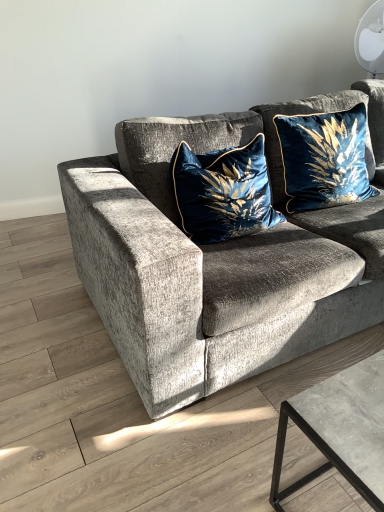
Question: Is velvet gray couch at center positioned far away from velvet blue pillow at center, acting as the 1th pillow starting from the left?

Choices:
 (A) no
 (B) yes

Answer: (A)

Question: Is velvet gray couch at center thinner than velvet blue pillow at center, acting as the 1th pillow starting from the left?

Choices:
 (A) no
 (B) yes

Answer: (A)

Question: Is velvet gray couch at center at the left side of velvet blue pillow at center, acting as the 1th pillow starting from the left?

Choices:
 (A) no
 (B) yes

Answer: (A)

Question: Considering the relative positions of velvet gray couch at center and velvet blue pillow at center, acting as the 1th pillow starting from the left, in the image provided, is velvet gray couch at center to the right of velvet blue pillow at center, acting as the 1th pillow starting from the left, from the viewer's perspective?

Choices:
 (A) yes
 (B) no

Answer: (A)

Question: From a real-world perspective, is velvet gray couch at center positioned under velvet blue pillow at center, acting as the 2th pillow starting from the right, based on gravity?

Choices:
 (A) no
 (B) yes

Answer: (B)

Question: Is velvet gray couch at center outside velvet blue pillow at center, acting as the 1th pillow starting from the left?

Choices:
 (A) yes
 (B) no

Answer: (A)

Question: Is velvet blue pillow at upper right, which ranks as the 2th pillow in left-to-right order, taller than velvet blue pillow at center, acting as the 1th pillow starting from the left?

Choices:
 (A) yes
 (B) no

Answer: (A)

Question: Would you say velvet blue pillow at upper right, the first pillow from the right, contains velvet blue pillow at center, acting as the 2th pillow starting from the right?

Choices:
 (A) yes
 (B) no

Answer: (B)

Question: Is velvet blue pillow at center, acting as the 1th pillow starting from the left, at the back of velvet blue pillow at upper right, the first pillow from the right?

Choices:
 (A) no
 (B) yes

Answer: (A)

Question: From a real-world perspective, is velvet blue pillow at upper right, which ranks as the 2th pillow in left-to-right order, on velvet blue pillow at center, acting as the 2th pillow starting from the right?

Choices:
 (A) no
 (B) yes

Answer: (B)

Question: Is velvet blue pillow at upper right, which ranks as the 2th pillow in left-to-right order, not inside velvet blue pillow at center, acting as the 2th pillow starting from the right?

Choices:
 (A) yes
 (B) no

Answer: (A)

Question: Is velvet blue pillow at upper right, the first pillow from the right, positioned far away from velvet blue pillow at center, acting as the 2th pillow starting from the right?

Choices:
 (A) yes
 (B) no

Answer: (B)

Question: Is velvet blue pillow at upper right, the first pillow from the right, further to camera compared to velvet gray couch at center?

Choices:
 (A) yes
 (B) no

Answer: (A)